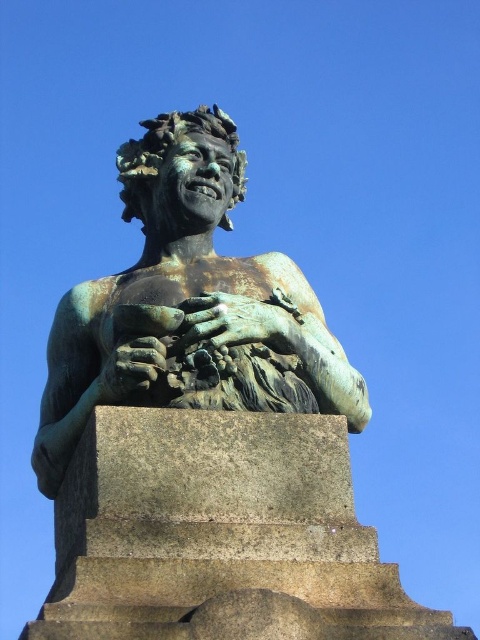
Who is more distant from viewer, (178, 314) or (134, 371)?

The point (178, 314) is more distant.

Does green patina bronze statue at center appear on the right side of bronze/greenish patina hand at center?

Incorrect, green patina bronze statue at center is not on the right side of bronze/greenish patina hand at center.

Which is in front, point (328, 348) or point (154, 371)?

Point (154, 371) is in front.

This screenshot has height=640, width=480. In order to click on green patina bronze statue at center in this screenshot , I will do `click(189, 298)`.

What do you see at coordinates (230, 321) in the screenshot? The width and height of the screenshot is (480, 640). I see `bronze/green patina hand at center` at bounding box center [230, 321].

Is bronze/green patina hand at center positioned at the back of bronze/greenish patina hand at center?

Yes.

You are a GUI agent. You are given a task and a screenshot of the screen. Output one action in this format:
    pyautogui.click(x=<x>, y=<y>)
    Task: Click on the bronze/green patina hand at center
    The height and width of the screenshot is (640, 480).
    Given the screenshot: What is the action you would take?
    pyautogui.click(x=230, y=321)

The image size is (480, 640). What are the coordinates of `bronze/green patina hand at center` in the screenshot? It's located at (230, 321).

Does green patina bronze statue at center appear on the right side of bronze/green patina hand at center?

No, green patina bronze statue at center is not to the right of bronze/green patina hand at center.

Is point (248, 282) positioned before point (253, 321)?

No, it is behind (253, 321).

You are a GUI agent. You are given a task and a screenshot of the screen. Output one action in this format:
    pyautogui.click(x=<x>, y=<y>)
    Task: Click on the green patina bronze statue at center
    Image resolution: width=480 pixels, height=640 pixels.
    Given the screenshot: What is the action you would take?
    (189, 298)